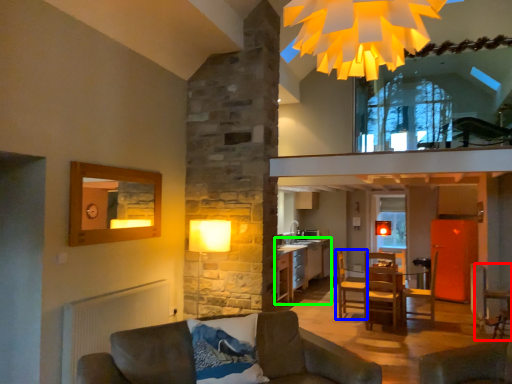
Question: Which object is the closest to the armchair (highlighted by a red box)? Choose among these: armchair (highlighted by a blue box) or cabinetry (highlighted by a green box).

Choices:
 (A) armchair
 (B) cabinetry

Answer: (A)